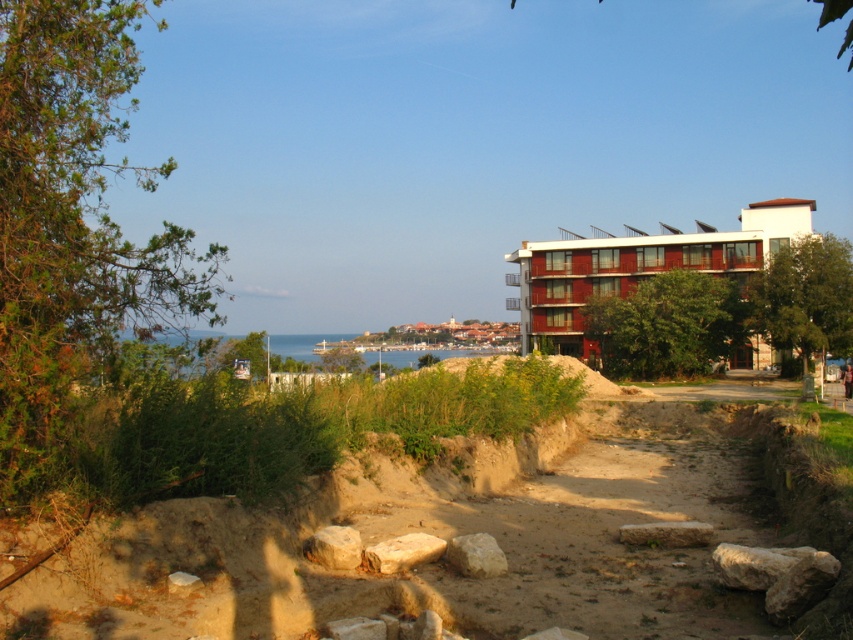
Locate an element on the screen. blue water at center is located at coordinates (194, 355).

Who is shorter, blue water at center or smooth beige stone at center?

Standing shorter between the two is smooth beige stone at center.

Which is in front, point (219, 355) or point (670, 540)?

Point (670, 540) is in front.

Locate an element on the screen. blue water at center is located at coordinates (194, 355).

Can you confirm if red wooden building at right is positioned above smooth beige rock at center?

Yes, red wooden building at right is above smooth beige rock at center.

Does red wooden building at right have a lesser width compared to smooth beige rock at center?

In fact, red wooden building at right might be wider than smooth beige rock at center.

Is point (579, 248) closer to camera compared to point (430, 547)?

No.

I want to click on red wooden building at right, so click(637, 268).

Between point (410, 349) and point (461, 552), which one is positioned behind?

Positioned behind is point (410, 349).

Does blue water at center have a lesser width compared to gray rough rock at center?

Incorrect, blue water at center's width is not less than gray rough rock at center's.

Locate an element on the screen. The width and height of the screenshot is (853, 640). blue water at center is located at coordinates (194, 355).